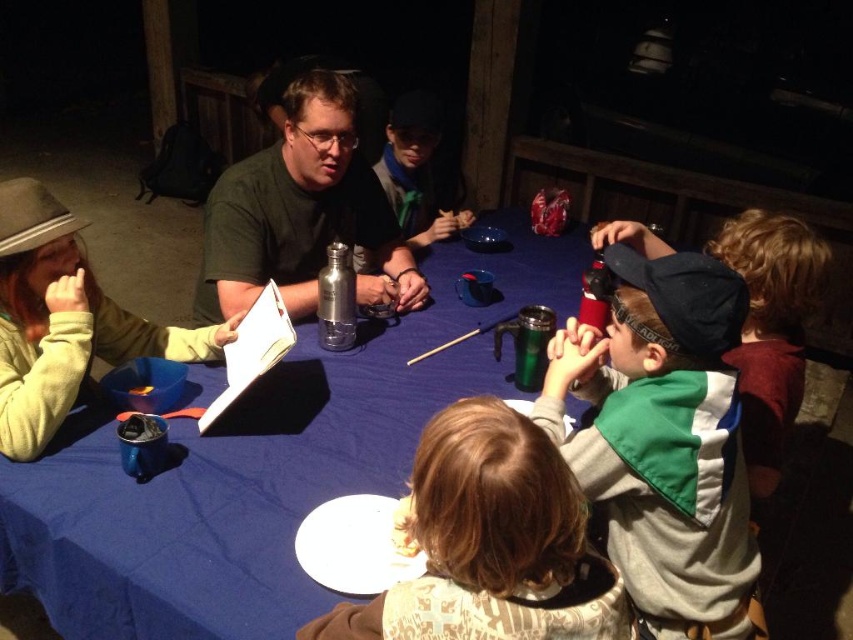
You are a person sitting at the blue fabric table at center and you want to reach the white paper plate at lower center. Is the plate within easy reach from your current position?

The blue fabric table at center is much taller than the white paper plate at lower center, so the plate might be positioned lower or further away, making it potentially difficult to reach easily from the table.

You are a server at this outdoor table and need to place a 36 inch long tray between the green fleece vest at lower right and the white paper plate at lower center. Can you fit it there?

The distance between the green fleece vest at lower right and the white paper plate at lower center is 34.81 inches. Since the tray is 36 inches long, it cannot fit in the space provided.

You are a photographer taking a photo of the light brown hair at center and the green scarf at center. Which object should you focus on first if you want to capture both in sharp focus?

The light brown hair at center is located below the green scarf at center. Since they are vertically aligned, adjusting the camera focus to the midpoint between them or using a small aperture for a deeper depth of field would ensure both are in focus.